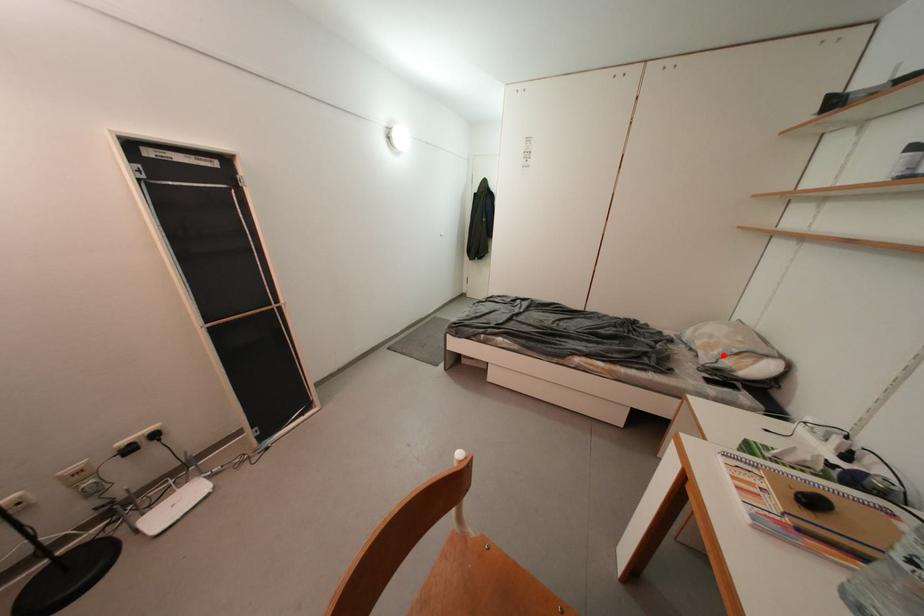
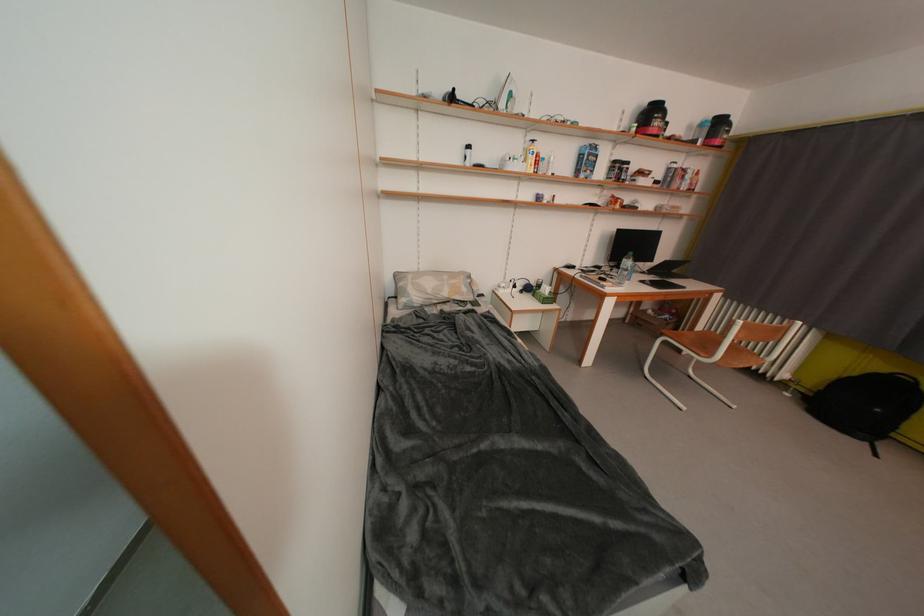
Question: I am providing you with two images of the same scene from different viewpoints. A red point is marked on the first image. Is the red point's position out of view in image 2?

Choices:
 (A) Yes
 (B) No

Answer: (B)